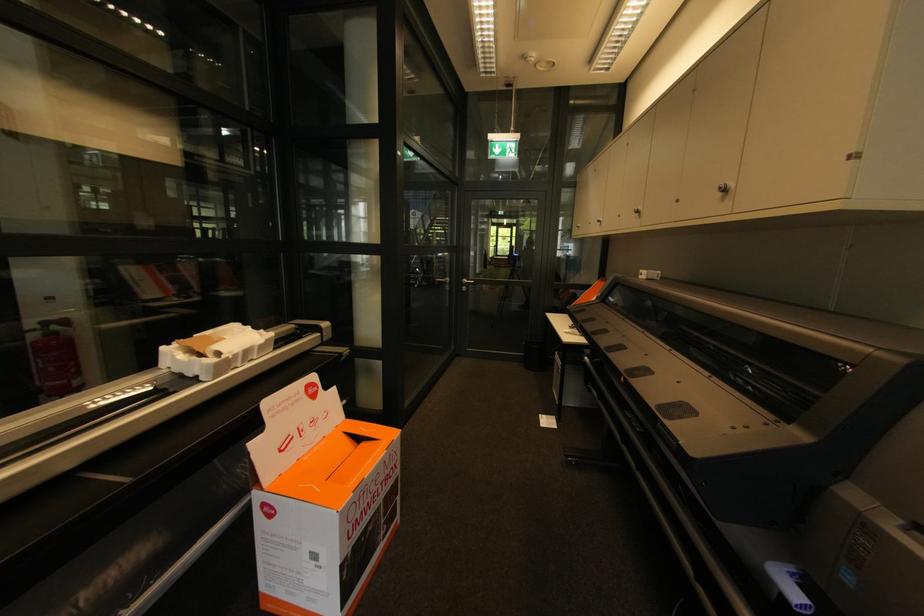
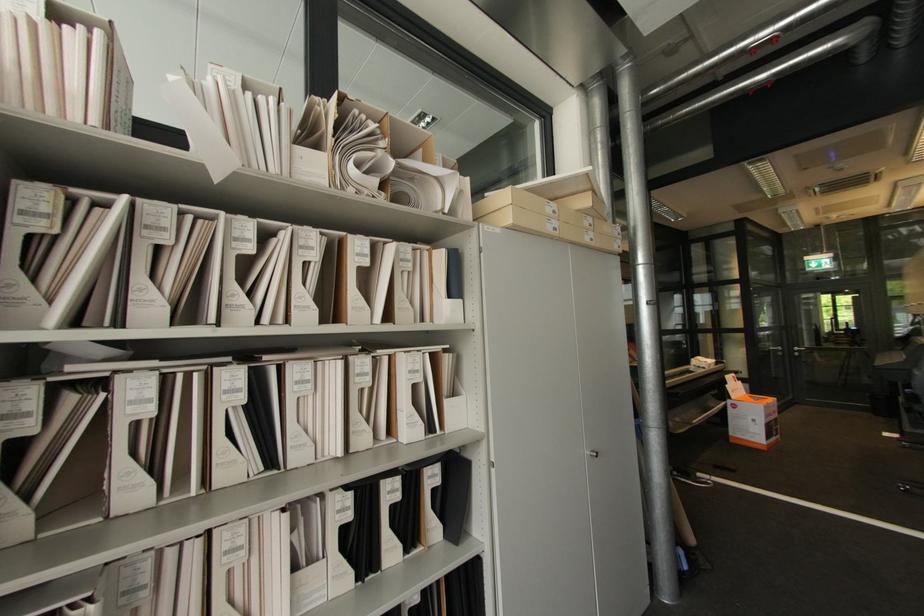
In the second image, find the point that corresponds to point (468, 289) in the first image.

(800, 354)